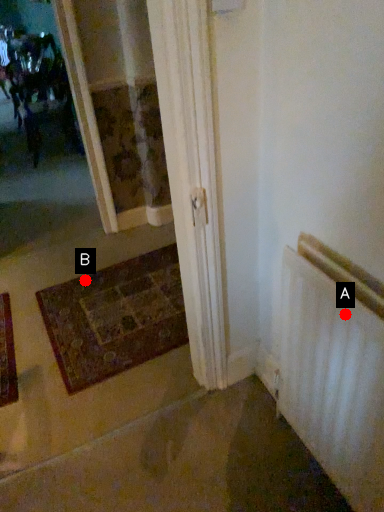
Question: Two points are circled on the image, labeled by A and B beside each circle. Which point is closer to the camera?

Choices:
 (A) A is closer
 (B) B is closer

Answer: (A)